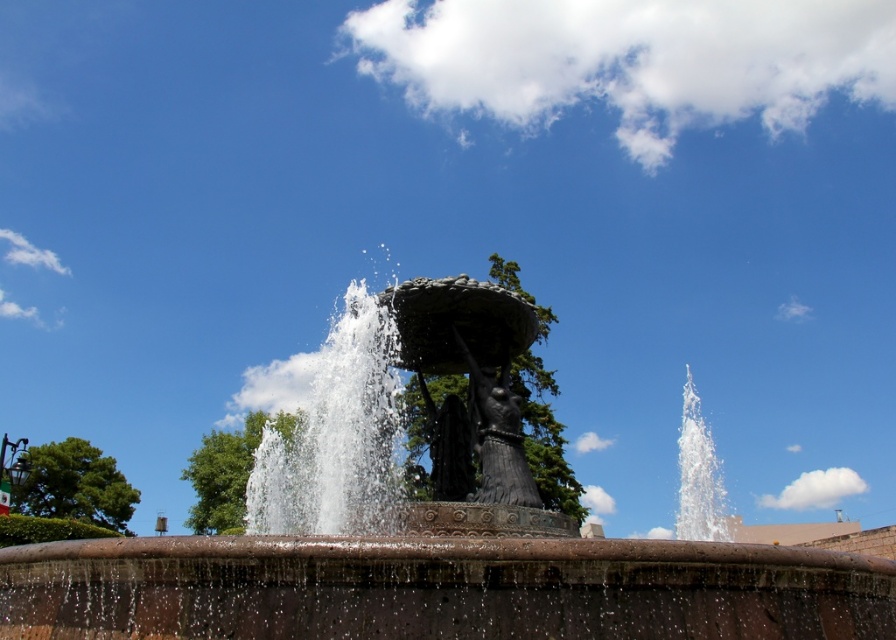
You are an art student analyzing the fountain composition. You observe the bronze statue at center and the black polished stone statue at center. Which statue would cast a longer shadow at noon given their sizes?

The bronze statue at center is larger in size than the black polished stone statue at center, so it would cast a longer shadow at noon.

You are a tour guide leading a group near the fountain. You want to ensure that visitors can walk comfortably between the bronze statue at center and the black polished stone statue at center. The path between them is 1.2 meters wide. Is this width sufficient for a group of 5 people to walk side by side?

The path between the bronze statue at center and the black polished stone statue at center is 1.2 meters wide. Since the average width required for a group of 5 people walking side by side is approximately 1.5 meters, the path is slightly narrower than needed, making it challenging for them to walk comfortably without overlapping.